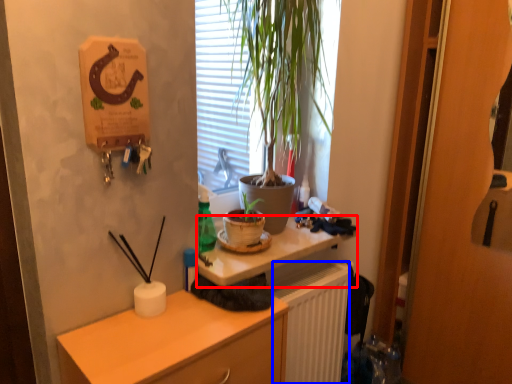
Question: Which object appears closest to the camera in this image, desk (highlighted by a red box) or radiator (highlighted by a blue box)?

Choices:
 (A) desk
 (B) radiator

Answer: (A)